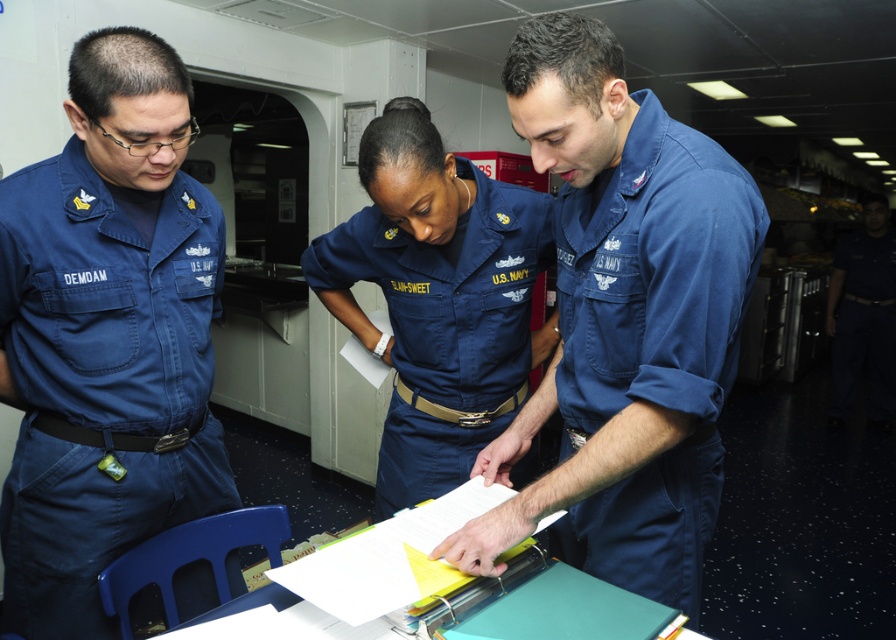
Question: Which is nearer to the navy blue fabric uniform at center?

Choices:
 (A) blue cotton shirt at left
 (B) blue cotton shirt at center

Answer: (B)

Question: Which point is farther to the camera?

Choices:
 (A) (444, 472)
 (B) (29, 310)
 (C) (593, 509)

Answer: (A)

Question: Is blue cotton shirt at center below navy blue fabric uniform at center?

Choices:
 (A) no
 (B) yes

Answer: (B)

Question: Among these objects, which one is nearest to the camera?

Choices:
 (A) blue cotton shirt at center
 (B) blue cotton shirt at left
 (C) navy blue fabric uniform at center

Answer: (A)

Question: Is blue cotton shirt at left smaller than navy blue fabric uniform at center?

Choices:
 (A) no
 (B) yes

Answer: (B)

Question: Is blue cotton shirt at left bigger than blue cotton shirt at center?

Choices:
 (A) yes
 (B) no

Answer: (A)